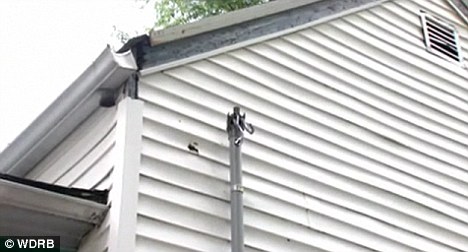
I want to click on vent, so click(445, 36).